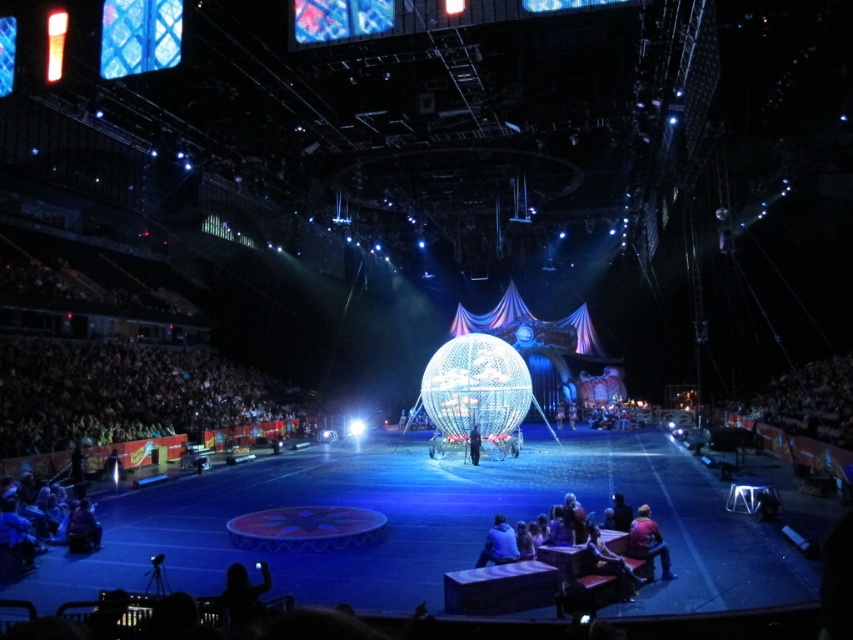
You are an audience member sitting in the stands and you want to check the jackets at the lower right corner of your view. Which jacket is positioned more to the left between the leather jacket at lower right and the red fabric jacket at lower right?

The leather jacket at lower right is positioned to the left of the red fabric jacket at lower right, so the leather jacket at lower right is more to the left.

You are a stagehand preparing to move the leather jacket at lower right and the red fabric jacket at lower right onto a small shelf. The shelf can only hold items that are narrower than 40 cm. Based on their widths, can both jackets fit on the shelf?

The leather jacket at lower right is wider than the red fabric jacket at lower right. Since the shelf requires items narrower than 40 cm, we need to check both jackets. If the leather jacket is wider than 40 cm, it won

Consider the image. You are a photographer positioned at the front of the arena, aiming to capture a clear shot of both the leather jacket at lower right and the red fabric jacket at lower right. Which jacket will appear larger in your photo?

The leather jacket at lower right will appear larger in the photo because it is closer to the viewer than the red fabric jacket at lower right.